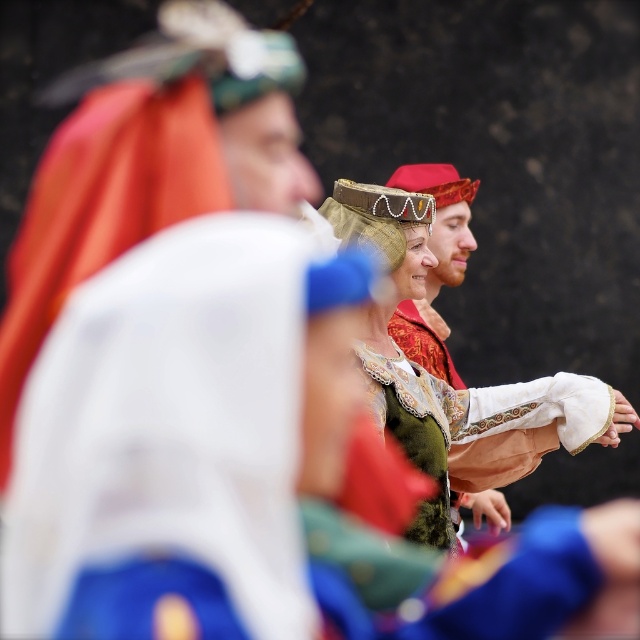
Question: Does green velvet dress at center appear over matte gold helmet at center?

Choices:
 (A) no
 (B) yes

Answer: (A)

Question: Which object is closer to the camera taking this photo?

Choices:
 (A) matte gold helmet at center
 (B) green velvet dress at center

Answer: (B)

Question: Is green velvet dress at center bigger than matte gold helmet at center?

Choices:
 (A) no
 (B) yes

Answer: (A)

Question: Is green velvet dress at center bigger than matte gold helmet at center?

Choices:
 (A) no
 (B) yes

Answer: (A)